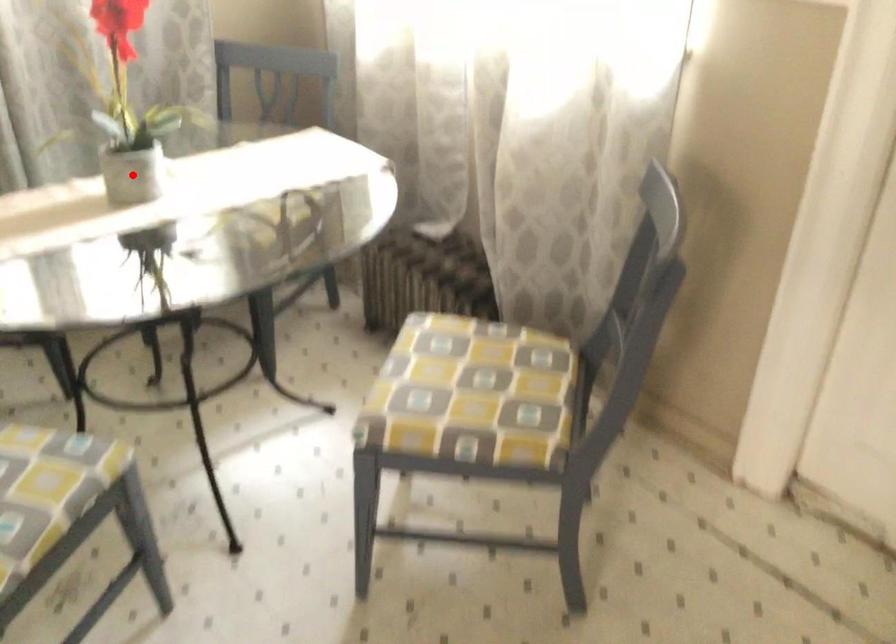
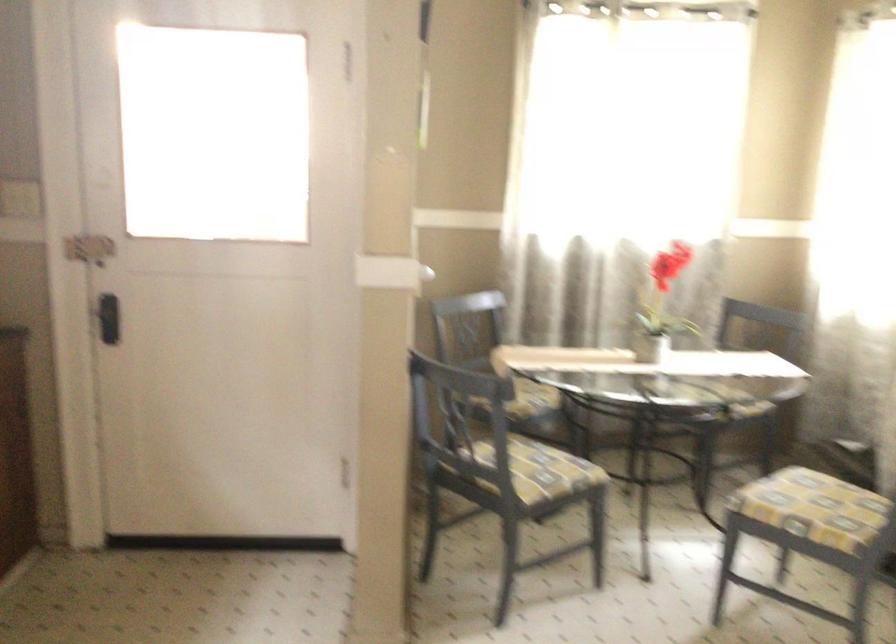
Question: I am providing you with two images of the same scene from different viewpoints. A red point is marked on the first image. At the location where the point appears in image 1, is it still visible in image 2?

Choices:
 (A) Yes
 (B) No

Answer: (B)